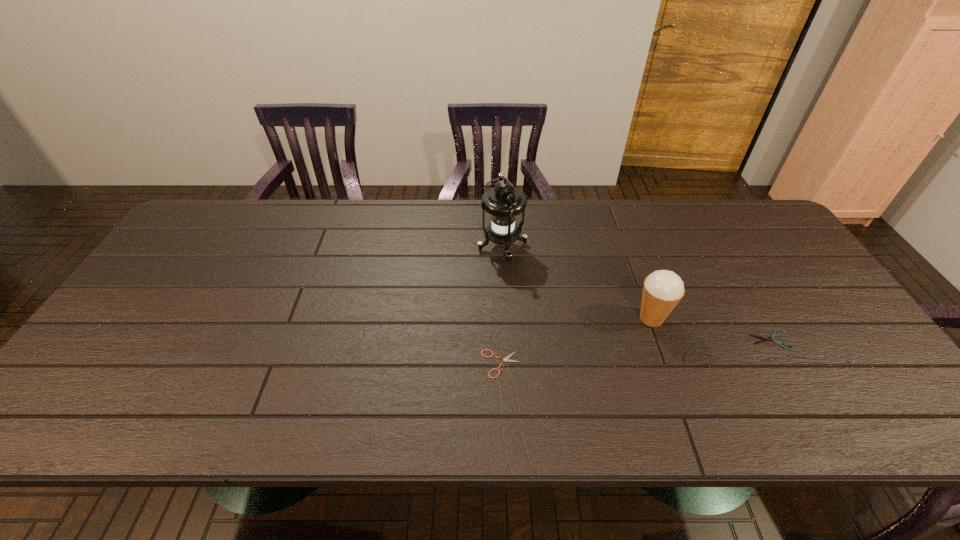
You are a GUI agent. You are given a task and a screenshot of the screen. Output one action in this format:
    pyautogui.click(x=<x>, y=<y>)
    Task: Click on the vacant space that satisfies the following two spatial constraints: 1. on the front side of the tallest object; 2. on the right side of the icecream
    Image resolution: width=960 pixels, height=540 pixels.
    Given the screenshot: What is the action you would take?
    pyautogui.click(x=506, y=319)